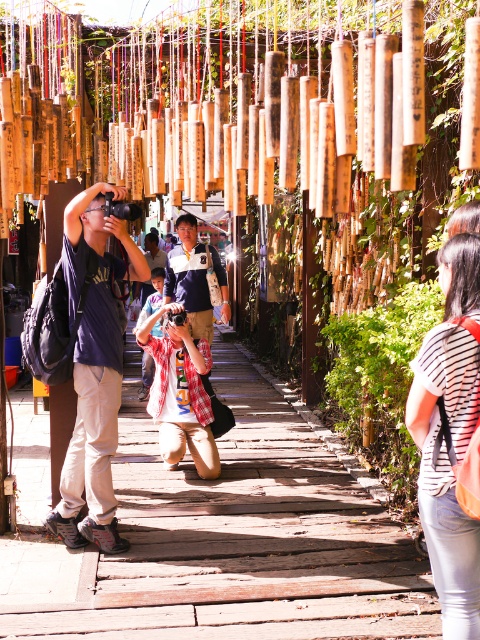
Question: Is wooden walkway at center below matte blue shirt at center?

Choices:
 (A) yes
 (B) no

Answer: (A)

Question: Which point appears closest to the camera in this image?

Choices:
 (A) (106, 468)
 (B) (24, 412)
 (C) (434, 472)

Answer: (C)

Question: Can you confirm if wooden walkway at center is positioned above matte blue shirt at center?

Choices:
 (A) no
 (B) yes

Answer: (A)

Question: Which point is closer to the camera taking this photo?

Choices:
 (A) (414, 390)
 (B) (205, 556)
 (C) (75, 344)

Answer: (A)

Question: Can you confirm if striped cotton shirt at right is smaller than matte blue shirt at center?

Choices:
 (A) yes
 (B) no

Answer: (A)

Question: Which point is farther from the camera taking this photo?

Choices:
 (A) (445, 259)
 (B) (143, 413)
 (C) (95, 243)

Answer: (B)